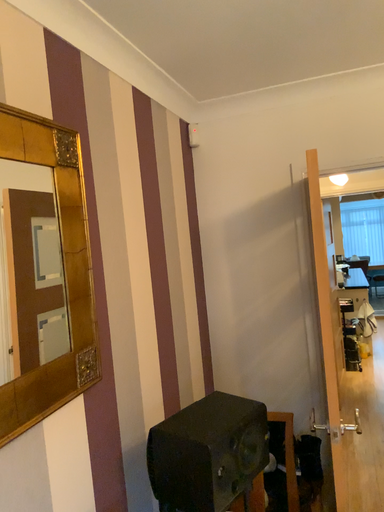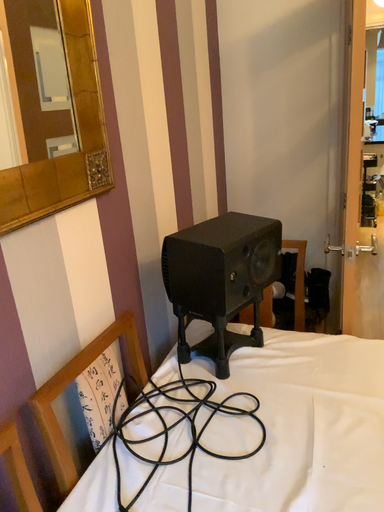
Question: Which way did the camera rotate in the video?

Choices:
 (A) rotated upward
 (B) rotated downward

Answer: (B)